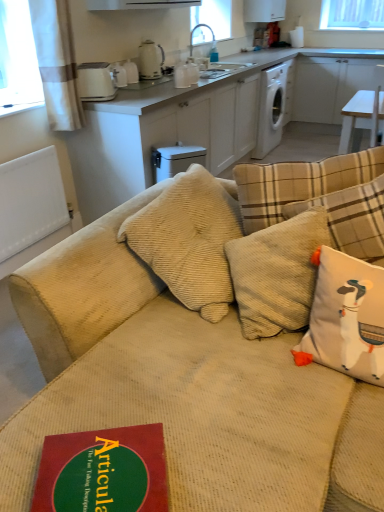
The height and width of the screenshot is (512, 384). Identify the location of vacant region above red matte paper at lower left (from a real-world perspective). (99, 475).